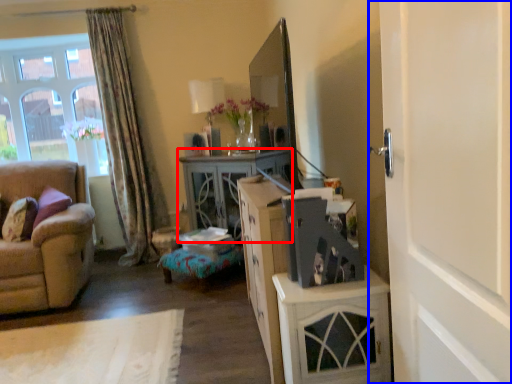
Question: Which object appears farthest to the camera in this image, desk (highlighted by a red box) or door (highlighted by a blue box)?

Choices:
 (A) desk
 (B) door

Answer: (A)